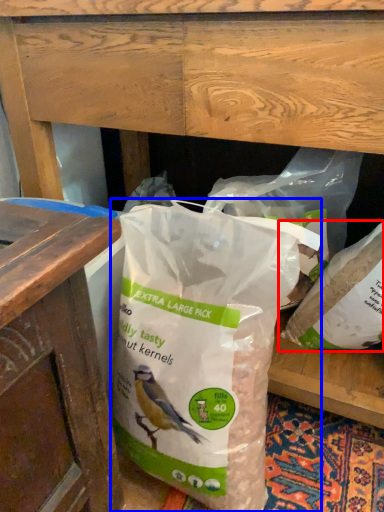
Question: Which point is closer to the camera, plastic bag (highlighted by a red box) or plastic bag (highlighted by a blue box)?

Choices:
 (A) plastic bag
 (B) plastic bag

Answer: (B)